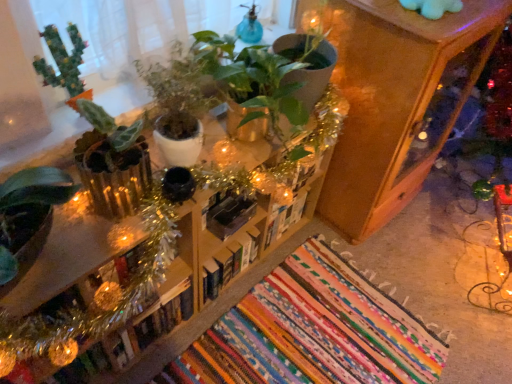
Question: Can you confirm if black matte bookshelf at center, the second book positioned from the right, is thinner than white matte book at center, acting as the 1th book starting from the right?

Choices:
 (A) yes
 (B) no

Answer: (A)

Question: From a real-world perspective, is black matte bookshelf at center, the second book positioned from the right, beneath white matte book at center, acting as the 1th book starting from the right?

Choices:
 (A) yes
 (B) no

Answer: (B)

Question: Considering the relative sizes of black matte bookshelf at center, the second book positioned from the right, and white matte book at center, which is the fourth book in left-to-right order, in the image provided, is black matte bookshelf at center, the second book positioned from the right, bigger than white matte book at center, which is the fourth book in left-to-right order,?

Choices:
 (A) yes
 (B) no

Answer: (B)

Question: Considering the relative sizes of black matte bookshelf at center, the second book positioned from the right, and white matte book at center, which is the fourth book in left-to-right order, in the image provided, is black matte bookshelf at center, the second book positioned from the right, wider than white matte book at center, which is the fourth book in left-to-right order,?

Choices:
 (A) no
 (B) yes

Answer: (A)

Question: Considering the relative positions of black matte bookshelf at center, the 3th book in the left-to-right sequence, and white matte book at center, acting as the 1th book starting from the right, in the image provided, is black matte bookshelf at center, the 3th book in the left-to-right sequence, to the right of white matte book at center, acting as the 1th book starting from the right, from the viewer's perspective?

Choices:
 (A) yes
 (B) no

Answer: (B)

Question: Looking at the image, does hardcover book at center, the fourth book viewed from the right, seem bigger or smaller compared to white matte book at center, acting as the 1th book starting from the right?

Choices:
 (A) small
 (B) big

Answer: (B)

Question: From the image's perspective, is hardcover book at center, the first book in the left-to-right sequence, positioned above or below white matte book at center, which is the fourth book in left-to-right order?

Choices:
 (A) below
 (B) above

Answer: (A)

Question: From a real-world perspective, is hardcover book at center, the first book in the left-to-right sequence, positioned above or below white matte book at center, which is the fourth book in left-to-right order?

Choices:
 (A) below
 (B) above

Answer: (A)

Question: Is point (140, 336) closer or farther from the camera than point (298, 216)?

Choices:
 (A) farther
 (B) closer

Answer: (B)

Question: From the image's perspective, relative to wooden cabinet at upper right, is hardcover book at center, which is the third book in right-to-left order, above or below?

Choices:
 (A) below
 (B) above

Answer: (A)

Question: Based on their sizes in the image, would you say hardcover book at center, arranged as the second book when viewed from the left, is bigger or smaller than wooden cabinet at upper right?

Choices:
 (A) small
 (B) big

Answer: (A)

Question: From a real-world perspective, is hardcover book at center, which is the third book in right-to-left order, above or below wooden cabinet at upper right?

Choices:
 (A) below
 (B) above

Answer: (A)

Question: Would you say hardcover book at center, which is the third book in right-to-left order, is to the left or to the right of wooden cabinet at upper right in the picture?

Choices:
 (A) left
 (B) right

Answer: (A)

Question: Looking at the image, does green matte cactus at upper left, positioned as the second houseplant in right-to-left order, seem bigger or smaller compared to wooden bookshelf at center?

Choices:
 (A) small
 (B) big

Answer: (A)

Question: In the image, is green matte cactus at upper left, positioned as the second houseplant in right-to-left order, on the left side or the right side of wooden bookshelf at center?

Choices:
 (A) right
 (B) left

Answer: (B)